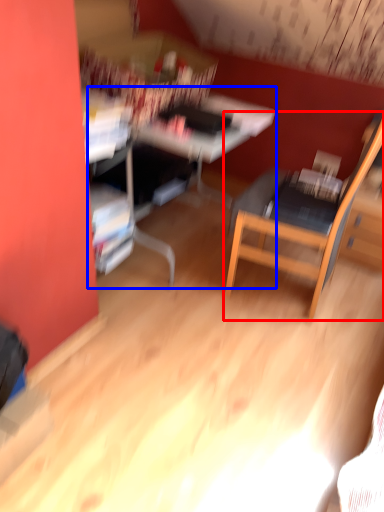
Question: Which object is closer to the camera taking this photo, chair (highlighted by a red box) or computer desk (highlighted by a blue box)?

Choices:
 (A) chair
 (B) computer desk

Answer: (A)